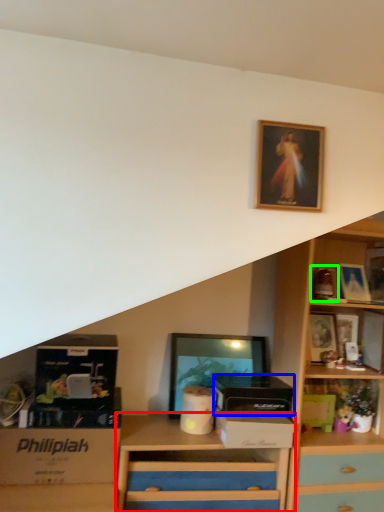
Question: Considering the real-world distances, which object is farthest from chest of drawers (highlighted by a red box)? box (highlighted by a blue box) or picture frame (highlighted by a green box)?

Choices:
 (A) box
 (B) picture frame

Answer: (B)